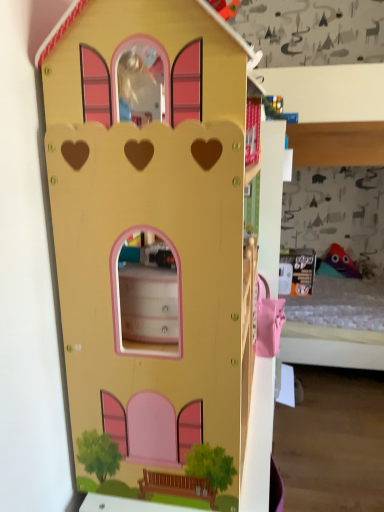
Question: Is multicolored fabric toy at right, placed as the second toy when sorted from front to back, situated inside matte yellow castle at center, which is counted as the 2th toy, starting from the right, or outside?

Choices:
 (A) outside
 (B) inside

Answer: (A)

Question: Considering their positions, is multicolored fabric toy at right, positioned as the 2th toy in left-to-right order, located in front of or behind matte yellow castle at center, the 2th toy viewed from the back?

Choices:
 (A) front
 (B) behind

Answer: (B)

Question: From the image's perspective, relative to matte yellow castle at center, the 2th toy viewed from the back, is multicolored fabric toy at right, placed as the second toy when sorted from front to back, above or below?

Choices:
 (A) below
 (B) above

Answer: (A)

Question: In the image, is matte yellow castle at center, which is counted as the 2th toy, starting from the right, positioned in front of or behind multicolored fabric toy at right, arranged as the first toy when viewed from the right?

Choices:
 (A) front
 (B) behind

Answer: (A)

Question: From the image's perspective, is matte yellow castle at center, the first toy from the left, positioned above or below multicolored fabric toy at right, arranged as the first toy when viewed from the right?

Choices:
 (A) below
 (B) above

Answer: (B)

Question: From a real-world perspective, is matte yellow castle at center, the first toy from the left, positioned above or below multicolored fabric toy at right, positioned as the 2th toy in left-to-right order?

Choices:
 (A) below
 (B) above

Answer: (B)

Question: Considering the relative positions of matte yellow castle at center, which is counted as the 2th toy, starting from the right, and multicolored fabric toy at right, positioned as the 2th toy in left-to-right order, in the image provided, is matte yellow castle at center, which is counted as the 2th toy, starting from the right, to the left or to the right of multicolored fabric toy at right, positioned as the 2th toy in left-to-right order,?

Choices:
 (A) right
 (B) left

Answer: (B)